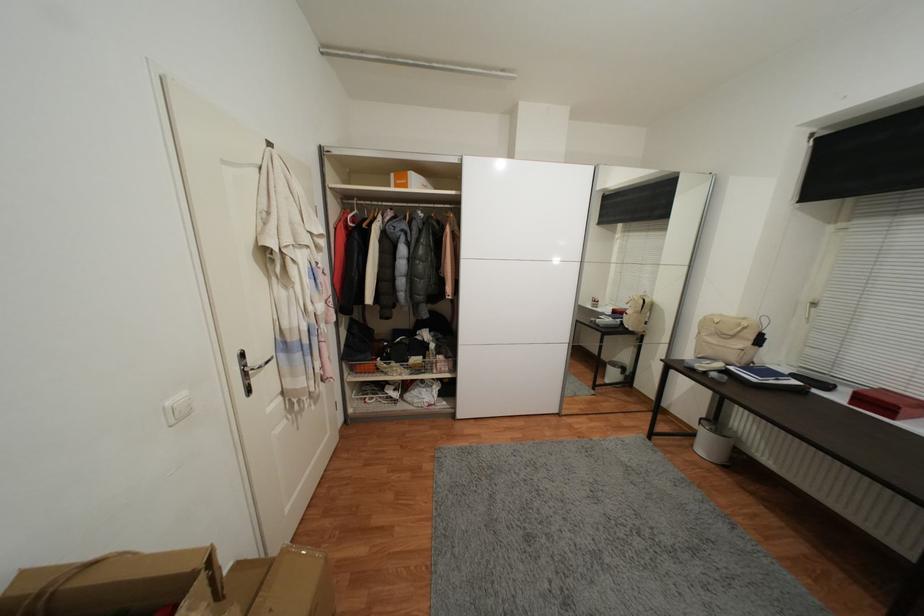
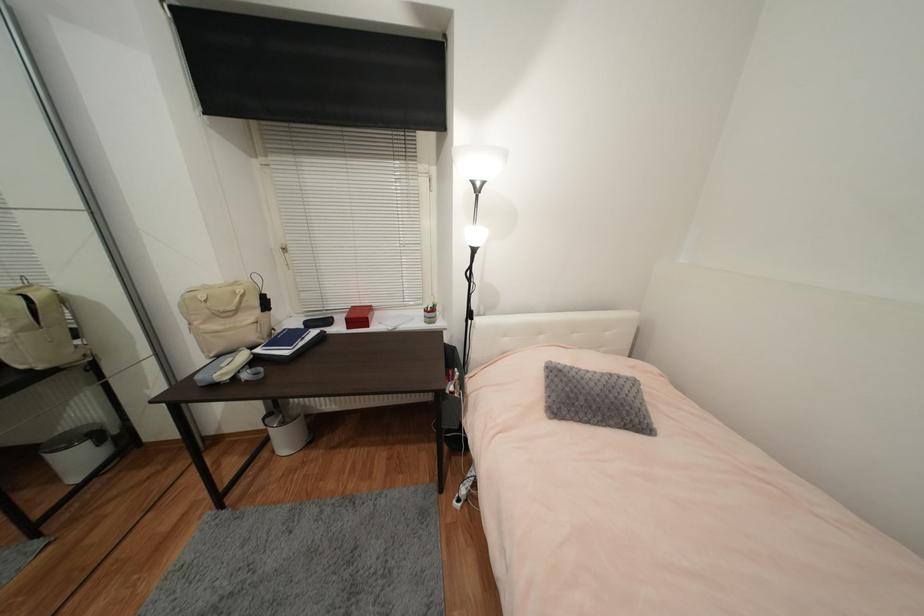
Find the pixel in the second image that matches point (617, 377) in the first image.

(83, 462)